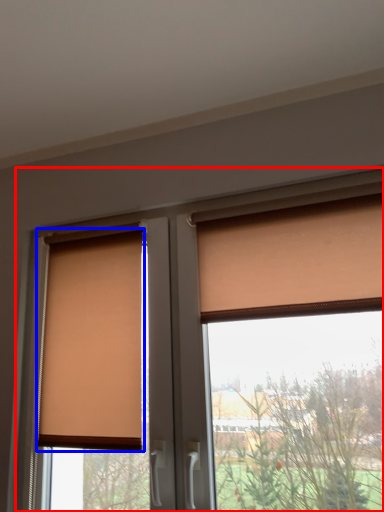
Question: Which object is further to the camera taking this photo, window (highlighted by a red box) or window blind (highlighted by a blue box)?

Choices:
 (A) window
 (B) window blind

Answer: (B)